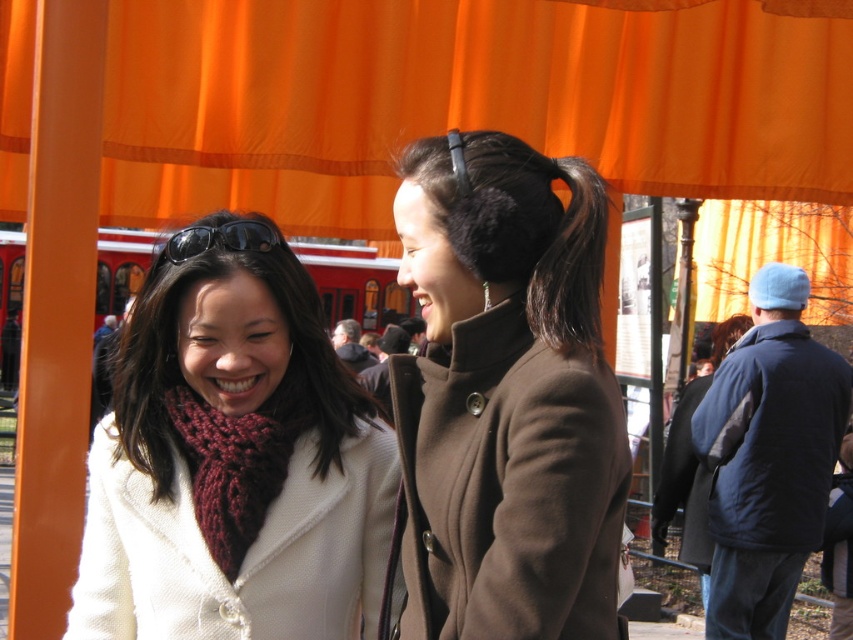
You are a photographer trying to capture a clear photo of the dark brown silky hair at upper center. However, the fuzzy black earmuffs at center is blocking your view. Can you adjust your position to take the photo without the earmuffs blocking it?

The fuzzy black earmuffs at center is in front of dark brown silky hair at upper center, so you need to move your position to the side or angle your camera to avoid the earmuffs blocking the view of the dark brown silky hair at upper center.

You are a photographer trying to capture a closeup of the fuzzy black earmuffs at center and the black wool coat at right. Since you want to focus on the earmuffs, which object should you adjust your camera lens to prioritize in terms of size in the frame?

The fuzzy black earmuffs at center is shorter than the black wool coat at right, so to prioritize the earmuffs in the frame, you should adjust your camera lens to focus on the smaller object.